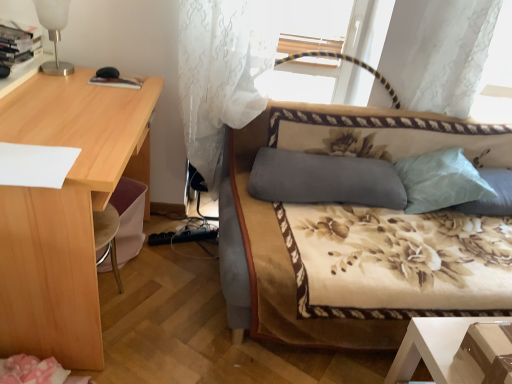
Question: Considering the relative positions of light blue fabric pillow at right, which is the 3th pillow in left-to-right order, and light blue textured pillow at upper right, which ranks as the second pillow in right-to-left order, in the image provided, is light blue fabric pillow at right, which is the 3th pillow in left-to-right order, behind light blue textured pillow at upper right, which ranks as the second pillow in right-to-left order,?

Choices:
 (A) yes
 (B) no

Answer: (A)

Question: Considering the relative sizes of light blue fabric pillow at right, which is the 3th pillow in left-to-right order, and light blue textured pillow at upper right, which ranks as the second pillow in right-to-left order, in the image provided, is light blue fabric pillow at right, which is the 3th pillow in left-to-right order, shorter than light blue textured pillow at upper right, which ranks as the second pillow in right-to-left order,?

Choices:
 (A) yes
 (B) no

Answer: (A)

Question: Does light blue fabric pillow at right, which is the 3th pillow in left-to-right order, have a smaller size compared to light blue textured pillow at upper right, which ranks as the second pillow in right-to-left order?

Choices:
 (A) yes
 (B) no

Answer: (A)

Question: Is the depth of light blue fabric pillow at right, which ranks as the first pillow in right-to-left order, less than that of light blue textured pillow at upper right, which ranks as the second pillow in right-to-left order?

Choices:
 (A) yes
 (B) no

Answer: (B)

Question: From the image's perspective, is light blue fabric pillow at right, which is the 3th pillow in left-to-right order, under light blue textured pillow at upper right, the second pillow in the left-to-right sequence?

Choices:
 (A) yes
 (B) no

Answer: (A)

Question: Would you consider light blue fabric pillow at right, which ranks as the first pillow in right-to-left order, to be distant from light blue textured pillow at upper right, the second pillow in the left-to-right sequence?

Choices:
 (A) no
 (B) yes

Answer: (A)

Question: Is white frosted glass table lamp at upper left taller than light blue fabric pillow at right, which is the 3th pillow in left-to-right order?

Choices:
 (A) no
 (B) yes

Answer: (B)

Question: Is white frosted glass table lamp at upper left aimed at light blue fabric pillow at right, which ranks as the first pillow in right-to-left order?

Choices:
 (A) no
 (B) yes

Answer: (B)

Question: Is white frosted glass table lamp at upper left bigger than light blue fabric pillow at right, which is the 3th pillow in left-to-right order?

Choices:
 (A) no
 (B) yes

Answer: (A)

Question: Is the surface of white frosted glass table lamp at upper left in direct contact with light blue fabric pillow at right, which ranks as the first pillow in right-to-left order?

Choices:
 (A) no
 (B) yes

Answer: (A)

Question: Does white frosted glass table lamp at upper left have a smaller size compared to light blue fabric pillow at right, which ranks as the first pillow in right-to-left order?

Choices:
 (A) no
 (B) yes

Answer: (B)

Question: Is white frosted glass table lamp at upper left behind light blue fabric pillow at right, which is the 3th pillow in left-to-right order?

Choices:
 (A) yes
 (B) no

Answer: (B)

Question: Is white frosted glass table lamp at upper left behind floral-patterned fabric couch at center?

Choices:
 (A) yes
 (B) no

Answer: (A)